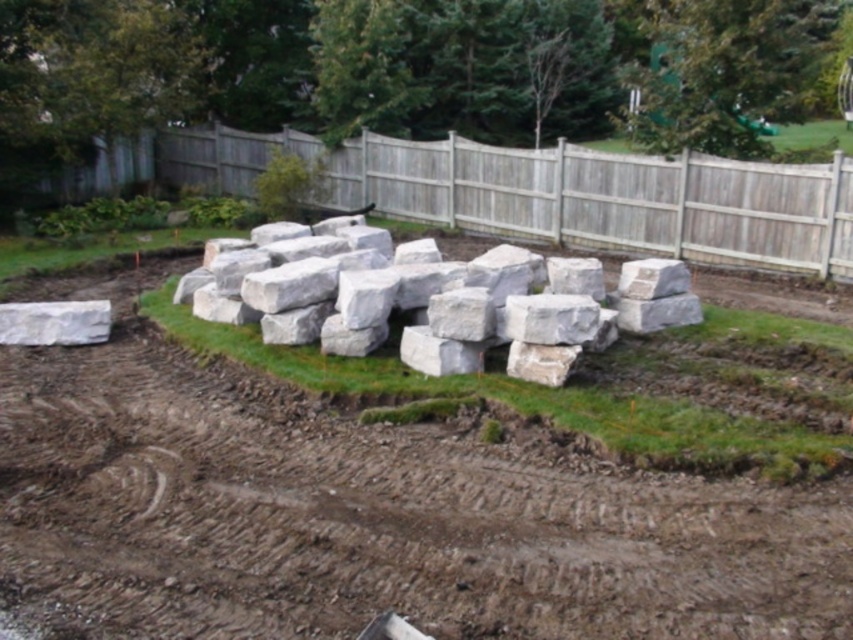
Question: Which object appears farthest from the camera in this image?

Choices:
 (A) white smooth boulder at left
 (B) white marble stones at center
 (C) brown soil at lower left

Answer: (A)

Question: Considering the relative positions of gray wood fence at center and white marble stones at center in the image provided, where is gray wood fence at center located with respect to white marble stones at center?

Choices:
 (A) left
 (B) right

Answer: (A)

Question: Does brown soil at lower left appear under gray wood fence at center?

Choices:
 (A) no
 (B) yes

Answer: (B)

Question: Does white marble stones at center appear under white smooth boulder at left?

Choices:
 (A) no
 (B) yes

Answer: (A)

Question: Which is farther from the white marble stones at center?

Choices:
 (A) gray wood fence at center
 (B) brown soil at lower left

Answer: (A)

Question: Which point is farther to the camera?

Choices:
 (A) brown soil at lower left
 (B) gray wood fence at center
 (C) white marble stones at center
 (D) white smooth boulder at left

Answer: (B)